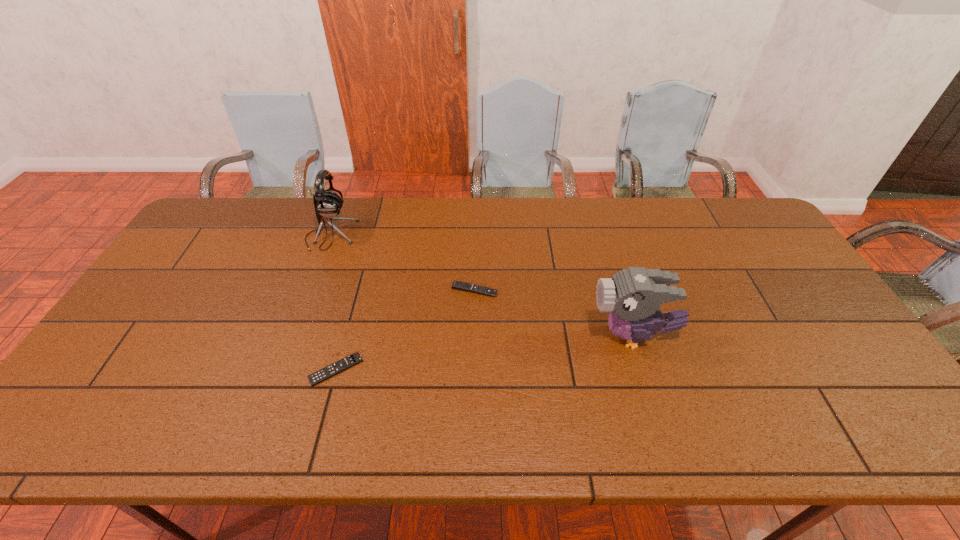
At what (x,y) coordinates should I click in order to perform the action: click on free spot between the third object from left to right and the nearest object. Please return your answer as a coordinate pair (x, y). Looking at the image, I should click on (405, 330).

Where is `vacant point located between the nearest object and the farthest object`? The width and height of the screenshot is (960, 540). vacant point located between the nearest object and the farthest object is located at coordinates pos(333,302).

Where is `empty space that is in between the taller remote control and the nearest object`? empty space that is in between the taller remote control and the nearest object is located at coordinates (405, 330).

Locate an element on the screen. The image size is (960, 540). free space between the nearest object and the third object from left to right is located at coordinates (405, 330).

You are a GUI agent. You are given a task and a screenshot of the screen. Output one action in this format:
    pyautogui.click(x=<x>, y=<y>)
    Task: Click on the empty location between the nearest object and the earphone
    This screenshot has height=540, width=960.
    Given the screenshot: What is the action you would take?
    pyautogui.click(x=333, y=302)

Find the location of a particular element. This screenshot has width=960, height=540. free space between the shortest object and the bird is located at coordinates (485, 353).

The width and height of the screenshot is (960, 540). In order to click on vacant space that is in between the bird and the earphone in this screenshot , I will do `click(482, 286)`.

The height and width of the screenshot is (540, 960). What are the coordinates of `vacant region between the farthest object and the second nearest object` in the screenshot? It's located at (482, 286).

Locate an element on the screen. The width and height of the screenshot is (960, 540). free space that is in between the nearest object and the third nearest object is located at coordinates (405, 330).

Select which object is the second closest to the right remote control. Please provide its 2D coordinates. Your answer should be formatted as a tuple, i.e. [(x, y)], where the tuple contains the x and y coordinates of a point satisfying the conditions above.

[(331, 370)]